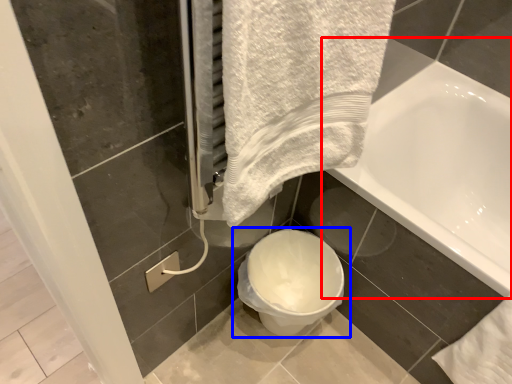
Question: Among these objects, which one is farthest to the camera, bathtub (highlighted by a red box) or toilet (highlighted by a blue box)?

Choices:
 (A) bathtub
 (B) toilet

Answer: (B)